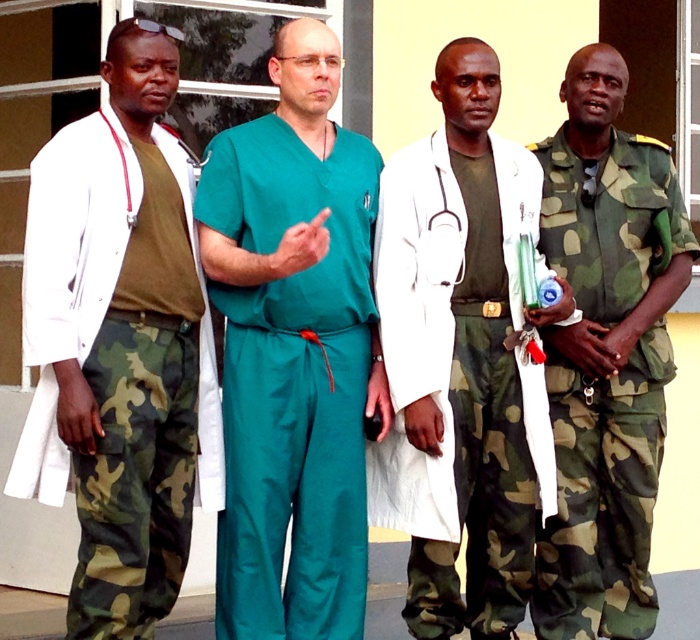
Is camo fabric pants at left taller than camo fabric uniform at right?

No, camo fabric pants at left is not taller than camo fabric uniform at right.

Based on the photo, can you confirm if camo fabric pants at left is positioned below camo fabric uniform at right?

No.

Who is more forward, (176, 428) or (676, 257)?

Point (176, 428) is more forward.

This screenshot has width=700, height=640. I want to click on camo fabric pants at left, so click(x=113, y=380).

Is the position of teal smooth scrubs at center less distant than that of camo fabric pants at left?

No, it is behind camo fabric pants at left.

Measure the distance between teal smooth scrubs at center and camera.

teal smooth scrubs at center is 18.22 feet away from camera.

Who is more forward, (308, 611) or (148, 528)?

Point (148, 528)

I want to click on teal smooth scrubs at center, so click(x=294, y=384).

Is white matte coat at center bigger than camo fabric pants at left?

No.

Is point (466, 132) more distant than point (49, 496)?

Yes.

The width and height of the screenshot is (700, 640). Identify the location of white matte coat at center. [x=462, y=378].